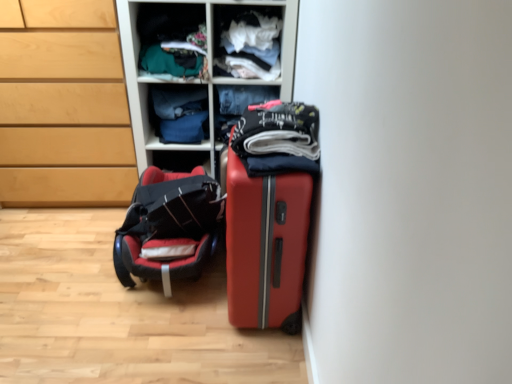
Question: Is matte red suitcase at center far from denim jeans at center, positioned as the 5th clothing in front-to-back order?

Choices:
 (A) no
 (B) yes

Answer: (A)

Question: Considering the relative positions of matte red suitcase at center and denim jeans at center, positioned as the 5th clothing in front-to-back order, in the image provided, is matte red suitcase at center to the right of denim jeans at center, positioned as the 5th clothing in front-to-back order, from the viewer's perspective?

Choices:
 (A) yes
 (B) no

Answer: (A)

Question: Does matte red suitcase at center lie in front of denim jeans at center, marked as the 1th clothing in a back-to-front arrangement?

Choices:
 (A) yes
 (B) no

Answer: (A)

Question: From the image's perspective, does matte red suitcase at center appear higher than denim jeans at center, marked as the 1th clothing in a back-to-front arrangement?

Choices:
 (A) yes
 (B) no

Answer: (B)

Question: Considering the relative positions of matte red suitcase at center and denim jeans at center, marked as the 1th clothing in a back-to-front arrangement, in the image provided, is matte red suitcase at center to the left of denim jeans at center, marked as the 1th clothing in a back-to-front arrangement, from the viewer's perspective?

Choices:
 (A) no
 (B) yes

Answer: (A)

Question: Does matte red suitcase at center come behind denim jeans at center, marked as the 1th clothing in a back-to-front arrangement?

Choices:
 (A) yes
 (B) no

Answer: (B)

Question: Does matte plastic shelves at upper center have a lesser height compared to matte wood chest of drawers at left?

Choices:
 (A) no
 (B) yes

Answer: (A)

Question: Does matte plastic shelves at upper center turn towards matte wood chest of drawers at left?

Choices:
 (A) no
 (B) yes

Answer: (A)

Question: Can matte wood chest of drawers at left be found inside matte plastic shelves at upper center?

Choices:
 (A) no
 (B) yes

Answer: (A)

Question: Is matte plastic shelves at upper center to the right of matte wood chest of drawers at left from the viewer's perspective?

Choices:
 (A) no
 (B) yes

Answer: (B)

Question: Is matte plastic shelves at upper center in front of matte wood chest of drawers at left?

Choices:
 (A) no
 (B) yes

Answer: (A)

Question: Does matte plastic shelves at upper center have a greater height compared to matte wood chest of drawers at left?

Choices:
 (A) yes
 (B) no

Answer: (A)

Question: Does matte green fabric at upper center, the third clothing from the front, have a lesser width compared to white cotton shirt at upper center, which is the fourth clothing in back-to-front order?

Choices:
 (A) yes
 (B) no

Answer: (B)